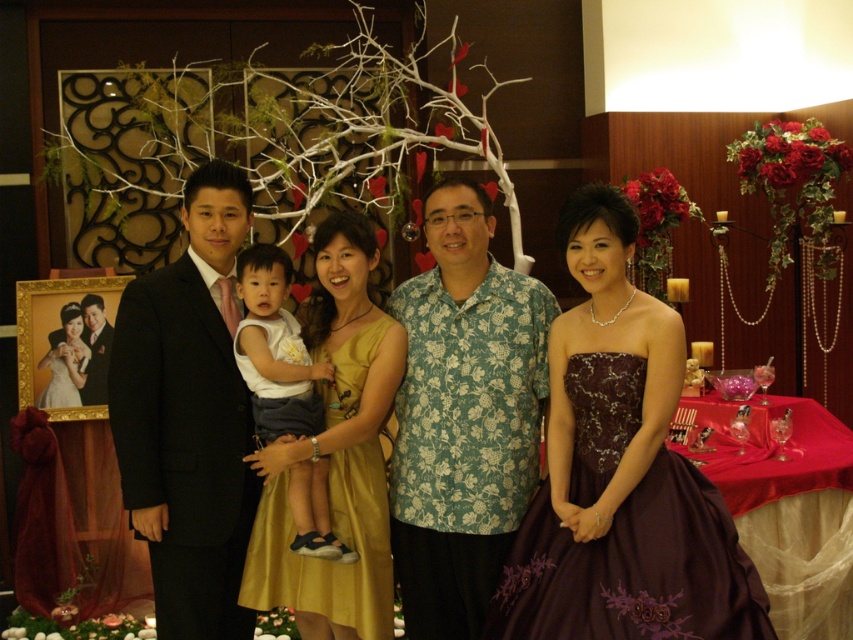
Does green floral shirt at center have a larger size compared to white cotton shirt at center?

Indeed, green floral shirt at center has a larger size compared to white cotton shirt at center.

Is green floral shirt at center positioned behind white cotton shirt at center?

Yes, it is.

The width and height of the screenshot is (853, 640). Identify the location of green floral shirt at center. (463, 416).

Does point (595, 417) come in front of point (213, 264)?

Yes, it is in front of point (213, 264).

Describe the element at coordinates (619, 472) in the screenshot. I see `purple satin dress at center` at that location.

Image resolution: width=853 pixels, height=640 pixels. In order to click on purple satin dress at center in this screenshot , I will do (x=619, y=472).

How far apart are purple satin dress at center and green floral shirt at center?

13.15 inches

Does purple satin dress at center have a greater width compared to green floral shirt at center?

Indeed, purple satin dress at center has a greater width compared to green floral shirt at center.

Is point (616, 272) in front of point (511, 508)?

Yes, it is in front of point (511, 508).

Image resolution: width=853 pixels, height=640 pixels. What are the coordinates of `purple satin dress at center` in the screenshot? It's located at (619, 472).